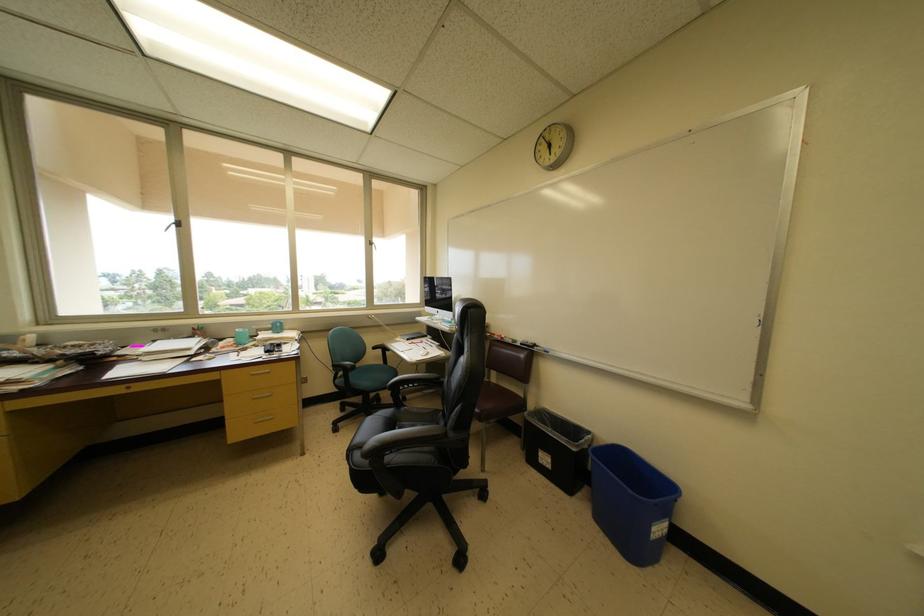
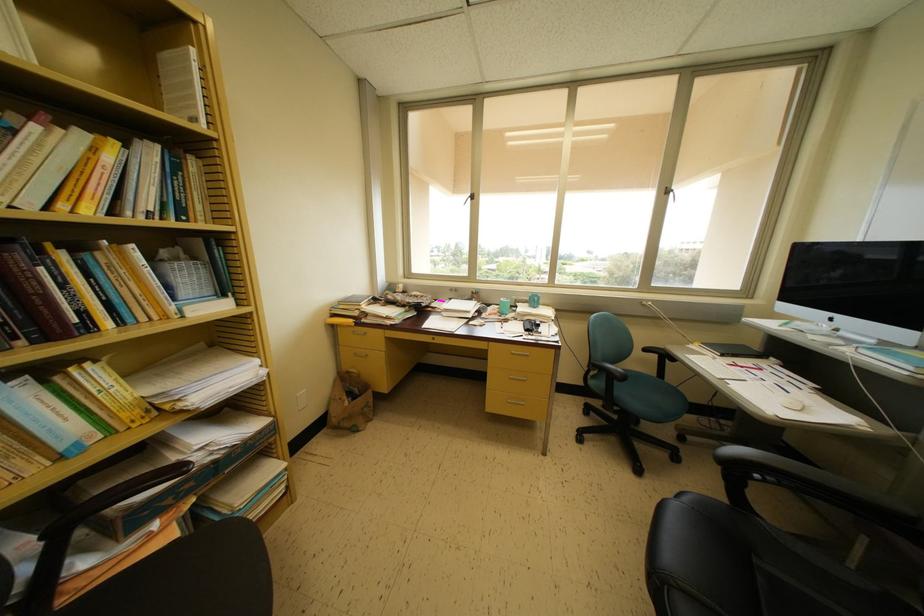
Find the pixel in the second image that matches [373,246] in the first image.

(671, 193)